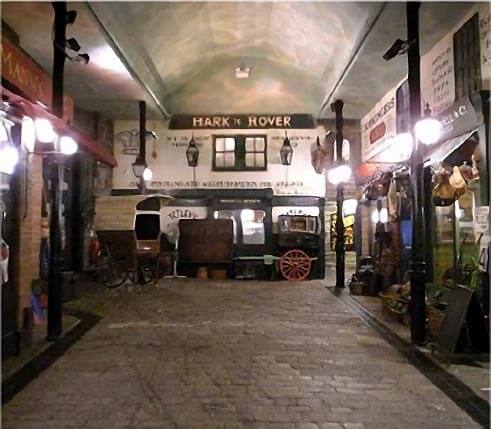
Locate an element on the screen. This screenshot has width=491, height=429. light hanging on right side closest is located at coordinates (431, 127).